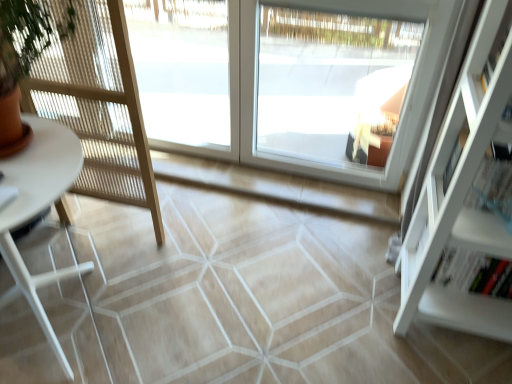
Question: In the image, is transparent glass window at center, placed as the 1th window when sorted from left to right, on the left side or the right side of white glass window at center, positioned as the second window in left-to-right order?

Choices:
 (A) right
 (B) left

Answer: (B)

Question: From the image's perspective, relative to white glass window at center, placed as the 2th window when sorted from right to left, is transparent glass window at center, placed as the 1th window when sorted from left to right, above or below?

Choices:
 (A) below
 (B) above

Answer: (B)

Question: Estimate the real-world distances between objects in this image. Which object is farther from the transparent glass window at center, placed as the 1th window when sorted from left to right?

Choices:
 (A) white glossy table at left
 (B) transparent glass window at center, placed as the 3th window when sorted from left to right
 (C) white glass window at center, positioned as the second window in left-to-right order
 (D) white matte shelf at right

Answer: (D)

Question: Considering the real-world distances, which object is farthest from the transparent glass window at center, placed as the 3th window when sorted from left to right?

Choices:
 (A) white matte shelf at right
 (B) white glass window at center, positioned as the second window in left-to-right order
 (C) transparent glass window at center, which appears as the 3th window when viewed from the right
 (D) white glossy table at left

Answer: (D)